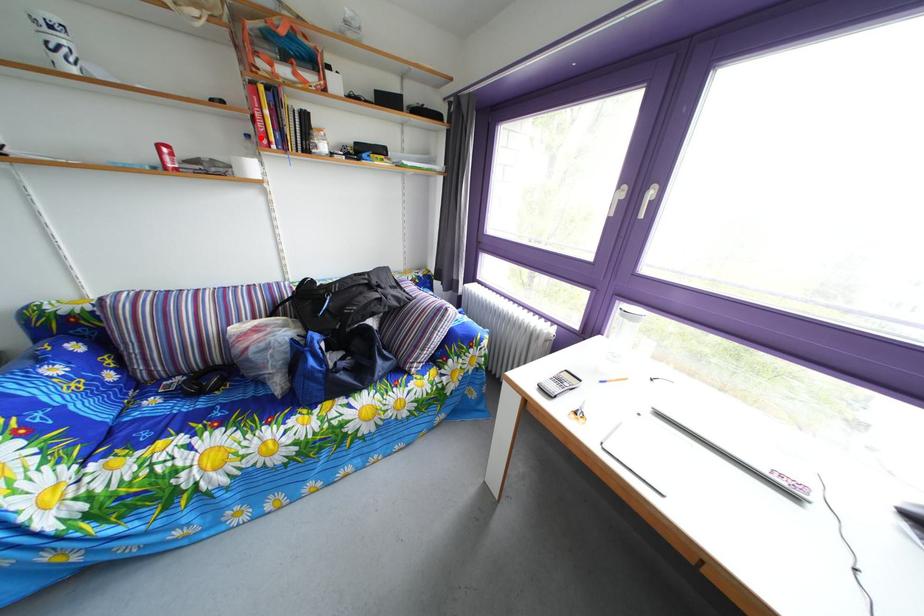
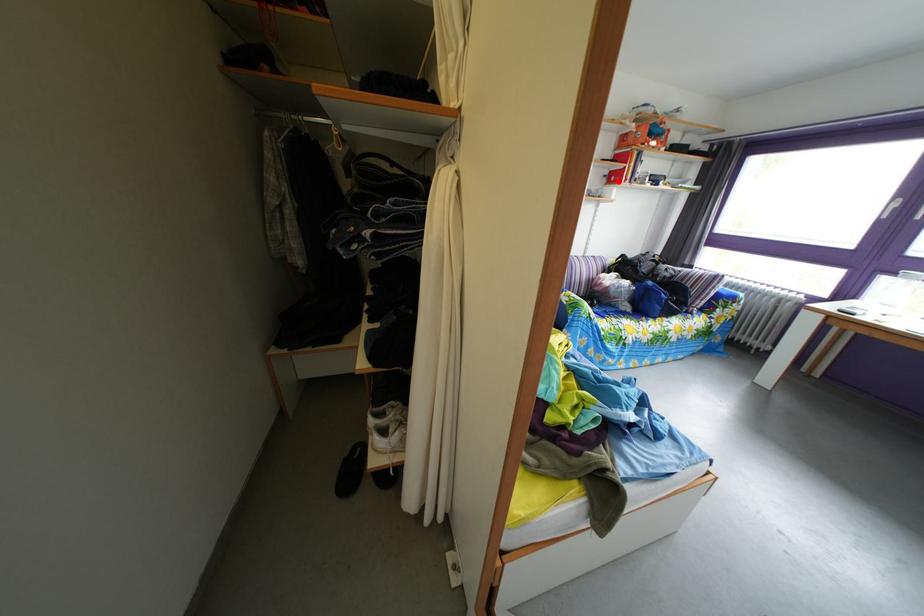
I am providing you with two images of the same scene from different viewpoints. A red point is marked on the first image and another point is marked on the second image. Do the highlighted points in image1 and image2 indicate the same real-world spot?

Yes